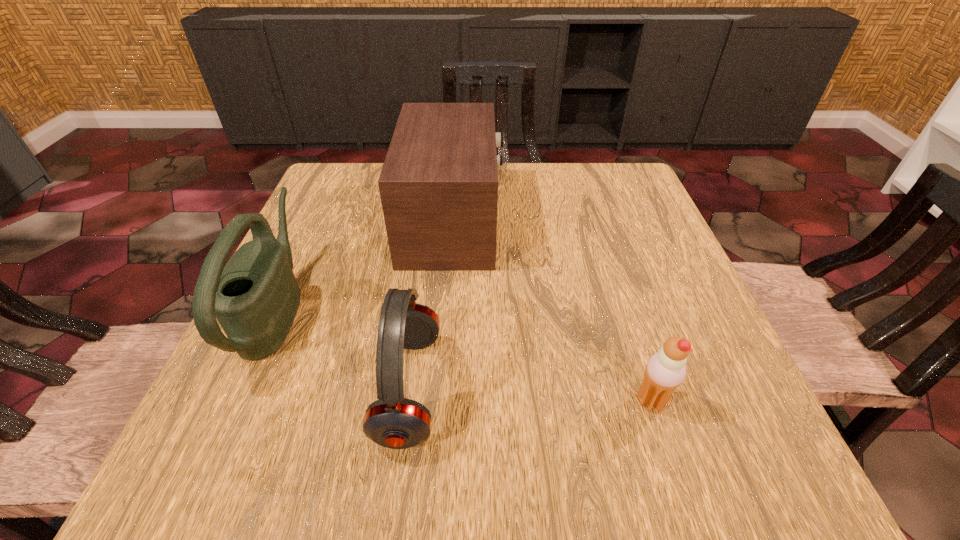
You are a GUI agent. You are given a task and a screenshot of the screen. Output one action in this format:
    pyautogui.click(x=<x>, y=<y>)
    Task: Click on the radio receiver
    The width and height of the screenshot is (960, 540).
    Given the screenshot: What is the action you would take?
    pyautogui.click(x=438, y=185)

At what (x,y) coordinates should I click in order to perform the action: click on the leftmost object. Please return your answer as a coordinate pair (x, y). Looking at the image, I should click on (255, 297).

This screenshot has width=960, height=540. Identify the location of earphone. (392, 421).

Where is `the rightmost object`? the rightmost object is located at coordinates (664, 372).

Where is `vacant region located on the front-facing side of the radio receiver`? The image size is (960, 540). vacant region located on the front-facing side of the radio receiver is located at coordinates (582, 221).

What are the coordinates of `vacant space located 0.380m on the spout of the watering can` in the screenshot? It's located at (508, 308).

Where is `vacant region located 0.320m on the ear cups of the earphone`? This screenshot has height=540, width=960. vacant region located 0.320m on the ear cups of the earphone is located at coordinates [x=642, y=388].

Image resolution: width=960 pixels, height=540 pixels. I want to click on free space located 0.080m at the front with a straw on the icecream, so point(582,401).

I want to click on vacant position located at the front with a straw on the icecream, so click(x=496, y=401).

Where is `vacant space situated 0.190m at the front with a straw on the icecream`? vacant space situated 0.190m at the front with a straw on the icecream is located at coordinates (510, 401).